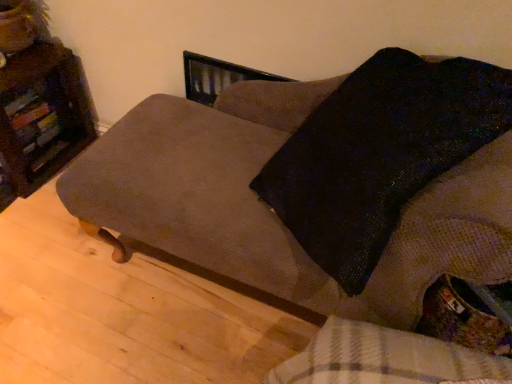
Question: Is suede-like brown couch at center bigger or smaller than wooden bookshelf at left?

Choices:
 (A) big
 (B) small

Answer: (A)

Question: From a real-world perspective, is suede-like brown couch at center positioned above or below wooden bookshelf at left?

Choices:
 (A) below
 (B) above

Answer: (B)

Question: Relative to wooden bookshelf at left, is suede-like brown couch at center in front or behind?

Choices:
 (A) behind
 (B) front

Answer: (B)

Question: Is point (28, 92) positioned closer to the camera than point (422, 284)?

Choices:
 (A) closer
 (B) farther

Answer: (B)

Question: From their relative heights in the image, would you say wooden bookshelf at left is taller or shorter than suede-like brown couch at center?

Choices:
 (A) short
 (B) tall

Answer: (A)

Question: From the image's perspective, is wooden bookshelf at left positioned above or below suede-like brown couch at center?

Choices:
 (A) below
 (B) above

Answer: (B)

Question: Would you say wooden bookshelf at left is to the left or to the right of suede-like brown couch at center in the picture?

Choices:
 (A) right
 (B) left

Answer: (B)